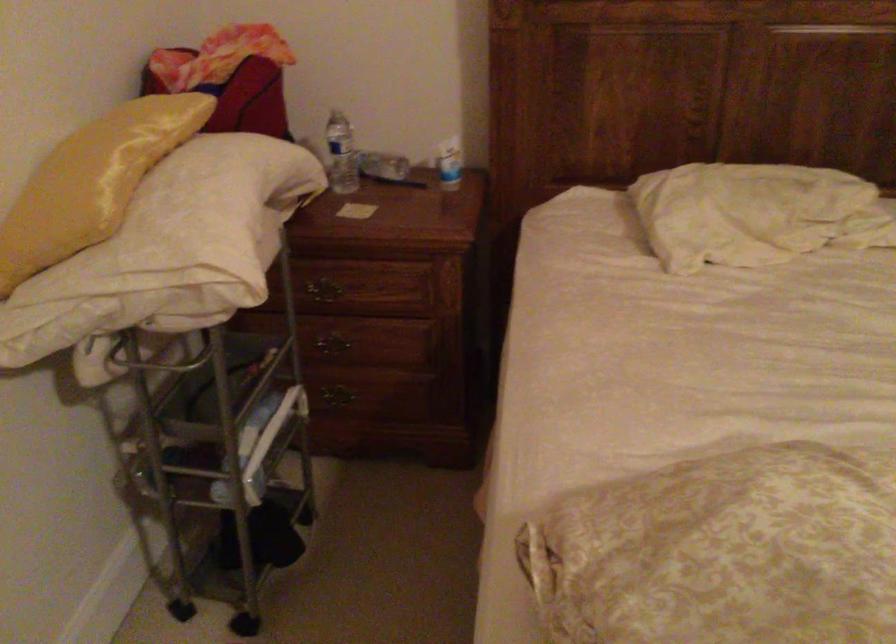
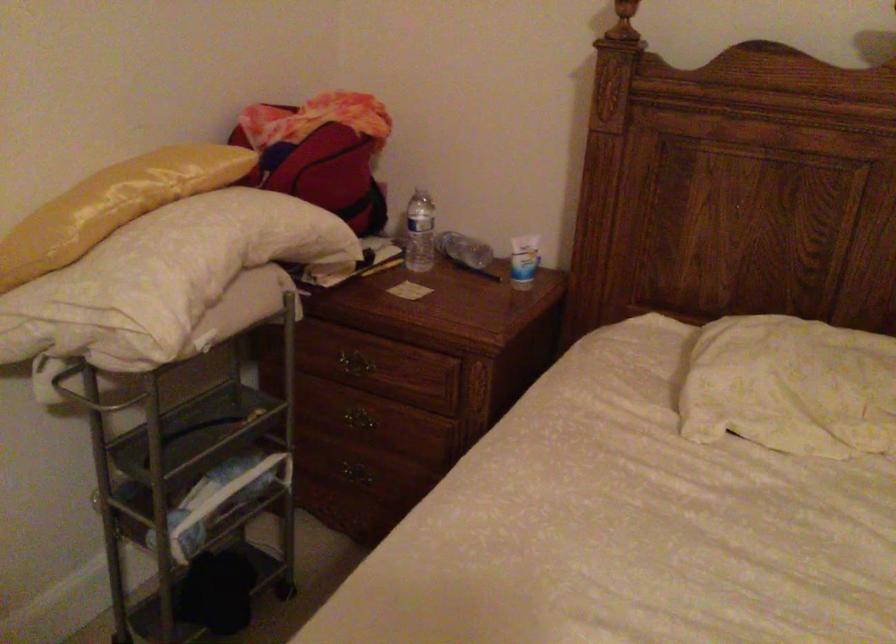
Question: Based on the continuous images, in which direction is the camera rotating? Reply with the corresponding letter.

Choices:
 (A) Left
 (B) Right
 (C) Up
 (D) Down

Answer: (A)